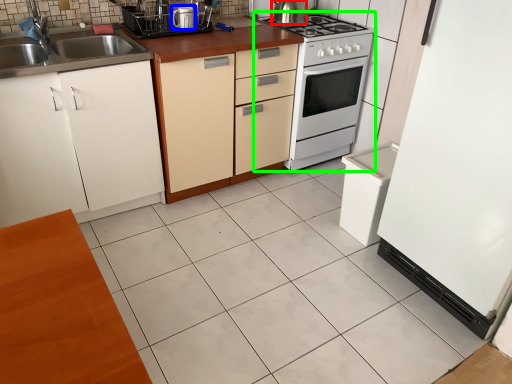
Question: Which object is positioned closest to kitchen appliance (highlighted by a red box)? Select from kitchen appliance (highlighted by a blue box) and home appliance (highlighted by a green box).

Choices:
 (A) kitchen appliance
 (B) home appliance

Answer: (B)